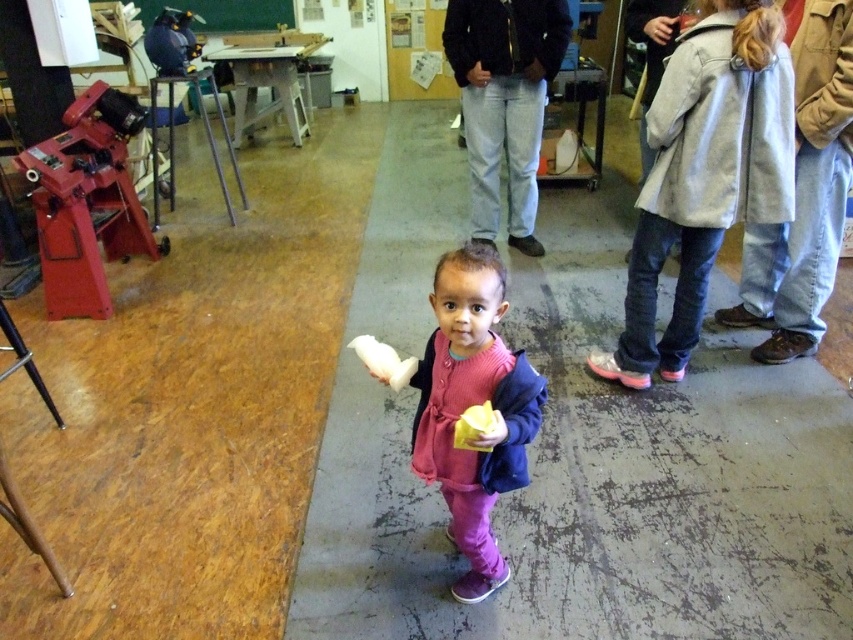
You are standing in the workshop and need to locate the light gray wool coat at right. According to the coordinates provided, where exactly is it positioned?

The light gray wool coat at right is positioned at coordinates point (705, 173).

You are a photographer setting up a shot in this scene. You want to place a small prop exactly at the point marked as point (705,173). What object will this prop be placed near?

The prop will be placed near the light gray wool coat at right, as point (705,173) corresponds to that object.